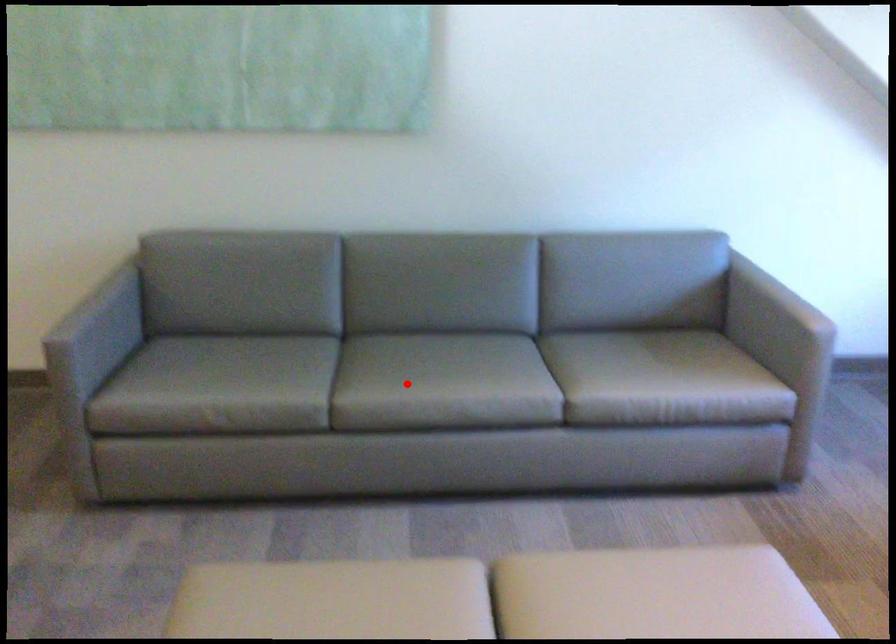
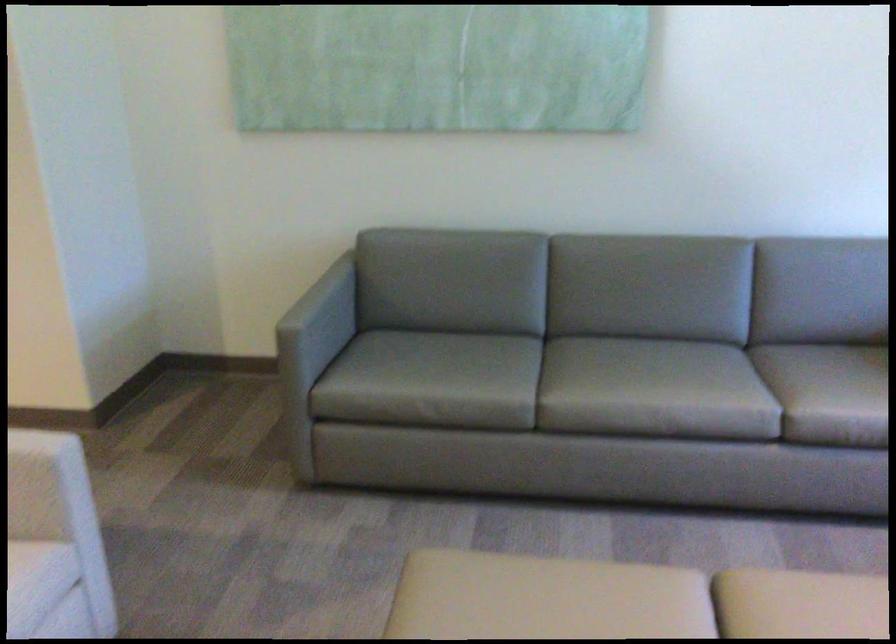
Question: I am providing you with two images of the same scene from different viewpoints. A red point is marked on the first image. Can you still see the location of the red point in image 2?

Choices:
 (A) Yes
 (B) No

Answer: (A)